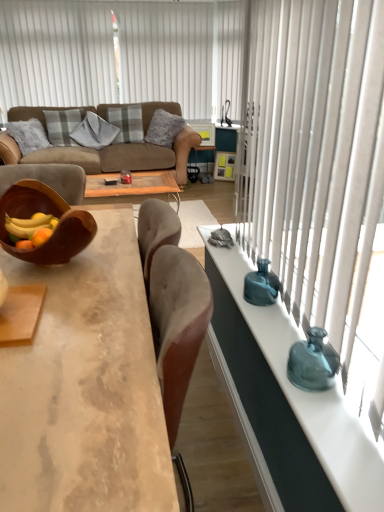
Find the location of `free region under brown wooden bowl at left (from a real-world perspective)`. free region under brown wooden bowl at left (from a real-world perspective) is located at coordinates (63, 268).